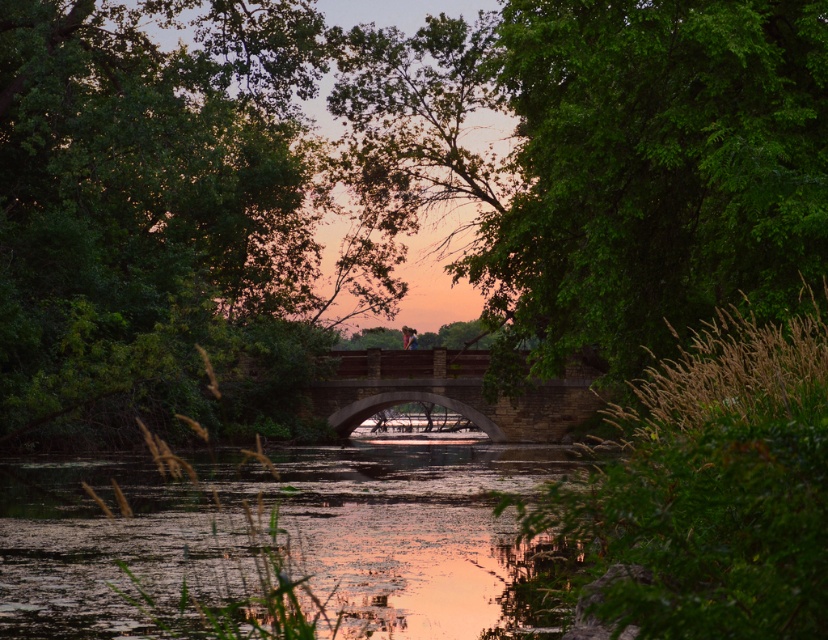
You are an artist trying to paint this scene. You want to ensure the green leafy tree at center and the brown stone bridge at center are proportionally accurate. Which object should you draw larger?

The green leafy tree at center should be drawn larger because it is bigger than the brown stone bridge at center according to the description.

You are a photographer planning to capture the brown stone bridge at center and the translucent green water at lower center in a single frame. Based on their sizes, which object should you focus on to ensure both are clearly visible in the photo?

The translucent green water at lower center has a larger size compared to the brown stone bridge at center. To ensure both are clearly visible, focus on the translucent green water at lower center since it occupies more space in the frame.